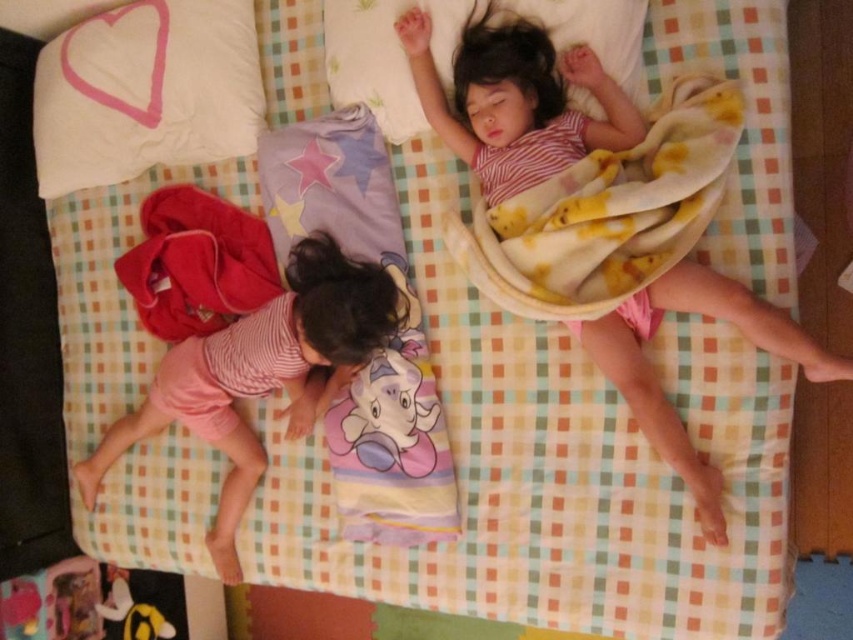
Question: Is yellow fleece blanket at upper right closer to the viewer compared to yellow plush toy at lower left?

Choices:
 (A) no
 (B) yes

Answer: (B)

Question: Among these points, which one is nearest to the camera?

Choices:
 (A) (621, 364)
 (B) (126, 570)

Answer: (A)

Question: Which of the following is the farthest from the observer?

Choices:
 (A) (334, 314)
 (B) (323, 22)
 (C) (386, 403)
 (D) (705, 182)

Answer: (B)

Question: Does yellow fleece blanket at upper right have a greater width compared to pink striped shirt at lower left?

Choices:
 (A) yes
 (B) no

Answer: (B)

Question: Which object is farther from the camera taking this photo?

Choices:
 (A) white soft pillow at upper left
 (B) yellow fleece blanket at upper right
 (C) yellow plush toy at lower left
 (D) white soft pillow at upper center

Answer: (C)

Question: Does yellow fleece blanket at upper right appear over yellow plush toy at lower left?

Choices:
 (A) no
 (B) yes

Answer: (B)